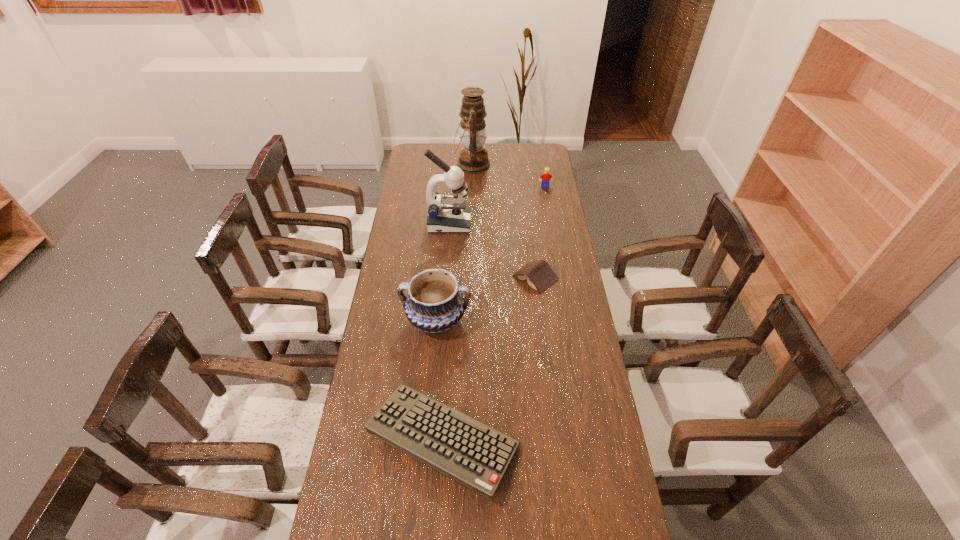
Where is `free space located on the front of the lantern`? free space located on the front of the lantern is located at coordinates (470, 226).

Where is `vacant space located 0.230m on the front of the microscope`? vacant space located 0.230m on the front of the microscope is located at coordinates (445, 271).

Locate an element on the screen. This screenshot has width=960, height=540. blank space located on the back of the second nearest object is located at coordinates (440, 288).

Locate an element on the screen. Image resolution: width=960 pixels, height=540 pixels. blank area located on the face of the Lego is located at coordinates (550, 217).

Locate an element on the screen. The width and height of the screenshot is (960, 540). blank space located on the back of the nearest object is located at coordinates (451, 296).

You are a GUI agent. You are given a task and a screenshot of the screen. Output one action in this format:
    pyautogui.click(x=<x>, y=<y>)
    Task: Click on the free space located 0.400m on the left of the book
    
    Given the screenshot: What is the action you would take?
    pyautogui.click(x=413, y=278)

Find the location of a particular element. object at the far edge is located at coordinates (473, 158).

Find the location of `microscope positioned at the left edge`. microscope positioned at the left edge is located at coordinates (447, 214).

This screenshot has width=960, height=540. What are the coordinates of `pottery at the left edge` in the screenshot? It's located at (435, 303).

Identify the location of computer keyboard that is at the left edge. (464, 449).